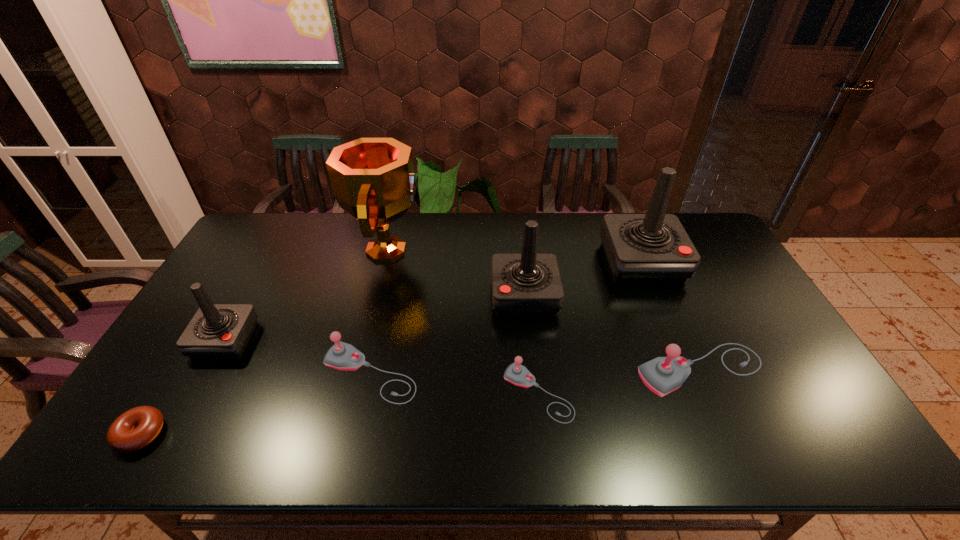
Identify the location of award. (372, 179).

I want to click on the tallest joystick, so click(x=653, y=248).

Locate an element on the screen. The height and width of the screenshot is (540, 960). the rightmost red joystick is located at coordinates (653, 248).

The height and width of the screenshot is (540, 960). Find the location of `the second red joystick from left to right`. the second red joystick from left to right is located at coordinates (529, 284).

This screenshot has width=960, height=540. What are the coordinates of `the fifth shortest joystick` in the screenshot? It's located at (529, 284).

The height and width of the screenshot is (540, 960). Find the location of `the smallest red joystick`. the smallest red joystick is located at coordinates (217, 331).

At what (x,y) coordinates should I click in order to perform the action: click on the fourth tallest object. Please return your answer as a coordinate pair (x, y). This screenshot has width=960, height=540. Looking at the image, I should click on (217, 331).

Locate an element on the screen. Image resolution: width=960 pixels, height=540 pixels. the fourth shortest object is located at coordinates (662, 375).

Where is `the third shortest joystick`? the third shortest joystick is located at coordinates (662, 375).

Locate an element on the screen. the second joystick from left to right is located at coordinates (342, 356).